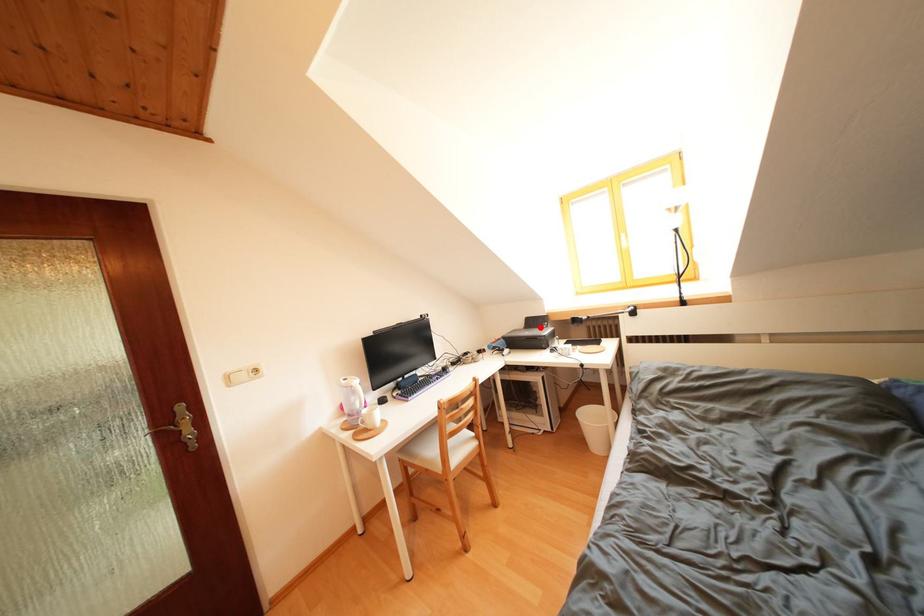
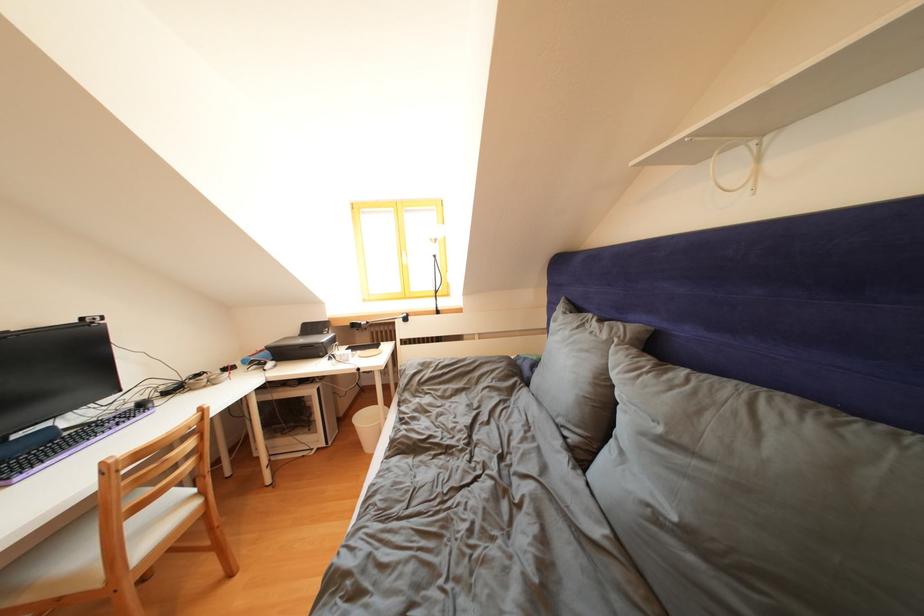
The point at the highlighted location is marked in the first image. Where is the corresponding point in the second image?

(319, 333)